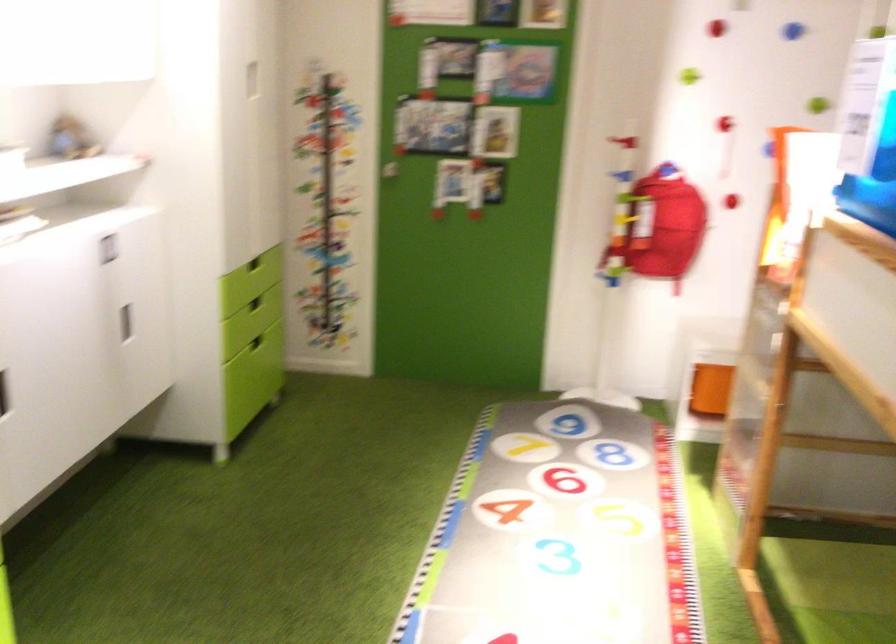
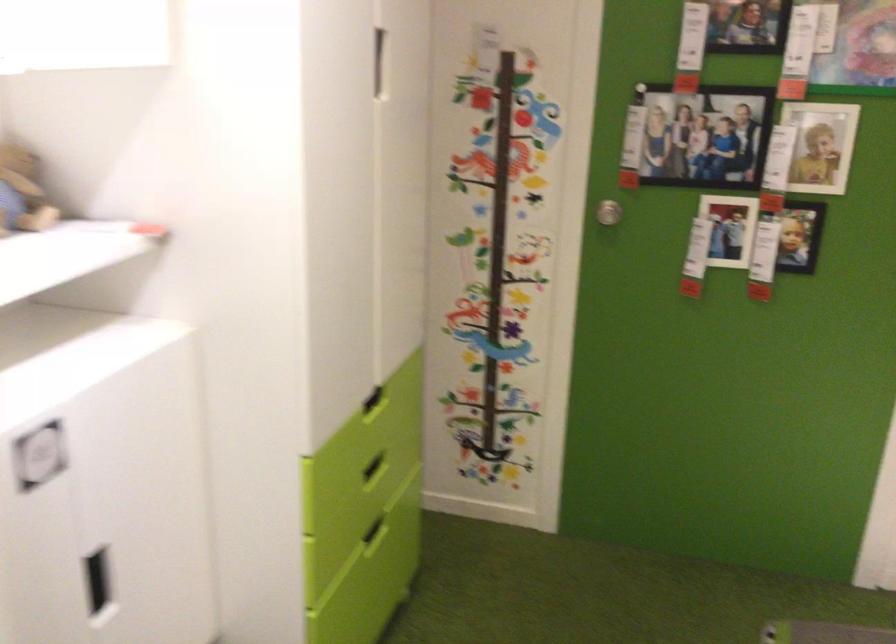
The point at (256, 80) is marked in the first image. Where is the corresponding point in the second image?

(377, 61)